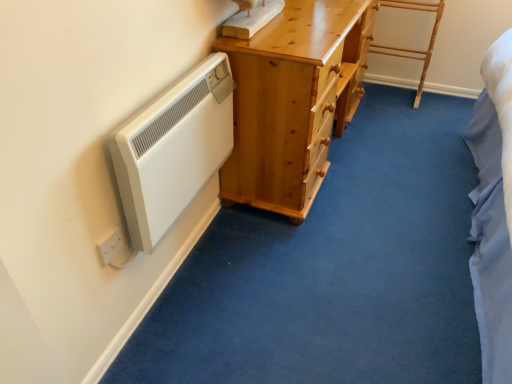
Question: From the image's perspective, is white plastic electric outlet at lower left on top of white matte radiator at left?

Choices:
 (A) no
 (B) yes

Answer: (A)

Question: Considering the relative sizes of white plastic electric outlet at lower left and white matte radiator at left in the image provided, is white plastic electric outlet at lower left taller than white matte radiator at left?

Choices:
 (A) yes
 (B) no

Answer: (B)

Question: From a real-world perspective, is white plastic electric outlet at lower left over white matte radiator at left?

Choices:
 (A) no
 (B) yes

Answer: (A)

Question: Is white plastic electric outlet at lower left positioned beyond the bounds of white matte radiator at left?

Choices:
 (A) no
 (B) yes

Answer: (B)

Question: Is white plastic electric outlet at lower left oriented away from white matte radiator at left?

Choices:
 (A) yes
 (B) no

Answer: (B)

Question: Is white plastic electric outlet at lower left to the right of white matte radiator at left from the viewer's perspective?

Choices:
 (A) yes
 (B) no

Answer: (B)

Question: Is light wood/rough textured ladder at upper right taller than light brown wooden chest of drawers at center?

Choices:
 (A) yes
 (B) no

Answer: (B)

Question: Is light wood/rough textured ladder at upper right closer to camera compared to light brown wooden chest of drawers at center?

Choices:
 (A) no
 (B) yes

Answer: (A)

Question: Considering the relative sizes of light wood/rough textured ladder at upper right and light brown wooden chest of drawers at center in the image provided, is light wood/rough textured ladder at upper right wider than light brown wooden chest of drawers at center?

Choices:
 (A) yes
 (B) no

Answer: (B)

Question: From the image's perspective, is light wood/rough textured ladder at upper right located beneath light brown wooden chest of drawers at center?

Choices:
 (A) yes
 (B) no

Answer: (B)

Question: Considering the relative sizes of light wood/rough textured ladder at upper right and light brown wooden chest of drawers at center in the image provided, is light wood/rough textured ladder at upper right smaller than light brown wooden chest of drawers at center?

Choices:
 (A) no
 (B) yes

Answer: (B)

Question: Is light wood/rough textured ladder at upper right looking in the opposite direction of light brown wooden chest of drawers at center?

Choices:
 (A) no
 (B) yes

Answer: (A)

Question: Does light wood/rough textured ladder at upper right lie in front of white matte radiator at left?

Choices:
 (A) no
 (B) yes

Answer: (A)